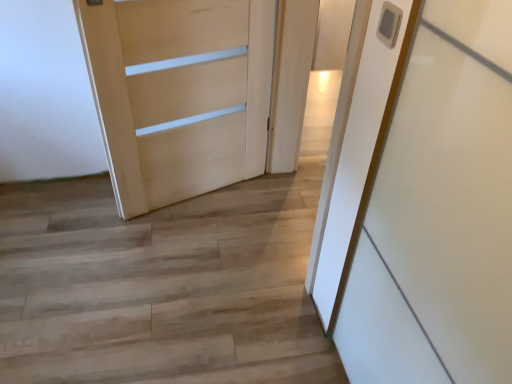
Image resolution: width=512 pixels, height=384 pixels. What are the coordinates of `unoccupied region to the right of light wood door at center, which appears as the 2th door when viewed from the right` in the screenshot? It's located at (254, 208).